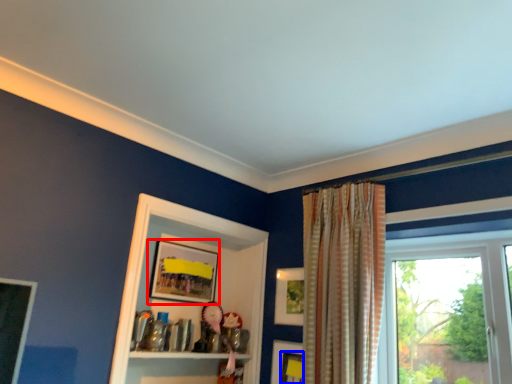
Question: Among these objects, which one is farthest to the camera, picture frame (highlighted by a red box) or picture frame (highlighted by a blue box)?

Choices:
 (A) picture frame
 (B) picture frame

Answer: (A)